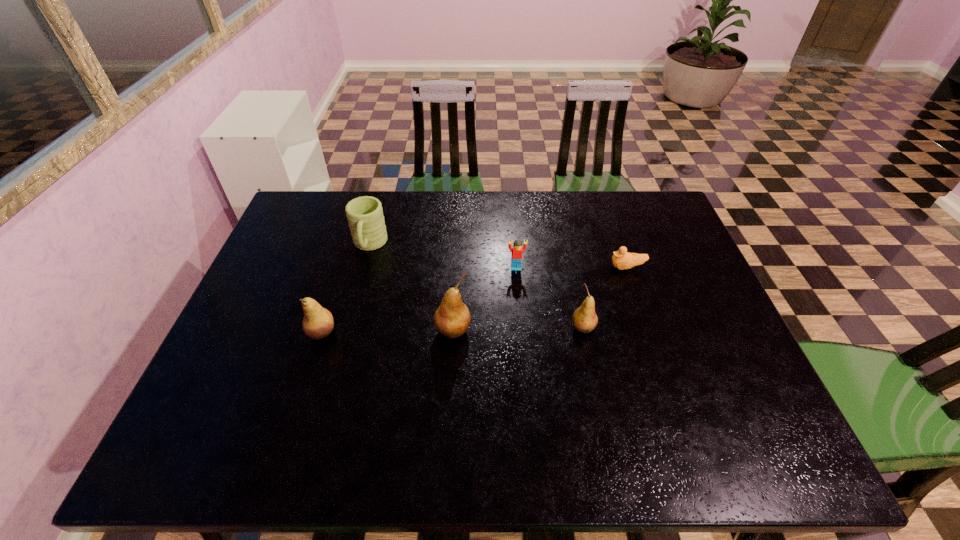
Where is `vacant space that satisfies the following two spatial constraints: 1. on the face of the duckling; 2. on the front side of the second tallest object`? Image resolution: width=960 pixels, height=540 pixels. vacant space that satisfies the following two spatial constraints: 1. on the face of the duckling; 2. on the front side of the second tallest object is located at coordinates (649, 333).

Find the location of a particular element. blank area in the image that satisfies the following two spatial constraints: 1. on the side of the rightmost pear with the handle; 2. on the right side of the mug is located at coordinates click(x=347, y=328).

Where is `free region that satisfies the following two spatial constraints: 1. on the side of the mug with the handle; 2. on the right side of the shortest pear`? This screenshot has width=960, height=540. free region that satisfies the following two spatial constraints: 1. on the side of the mug with the handle; 2. on the right side of the shortest pear is located at coordinates (347, 328).

Locate an element on the screen. free space in the image that satisfies the following two spatial constraints: 1. on the face of the shortest object; 2. on the face of the third object from right to left is located at coordinates (627, 268).

The height and width of the screenshot is (540, 960). Identify the location of free space that satisfies the following two spatial constraints: 1. on the face of the shortest object; 2. on the front side of the fifth shortest object. (649, 333).